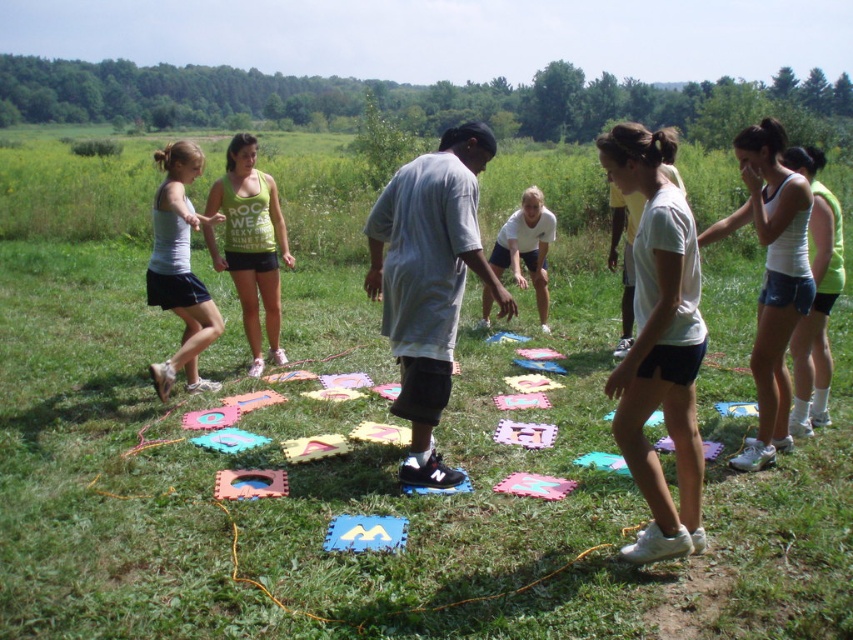
Question: Estimate the real-world distances between objects in this image. Which object is closer to the matte gray tank top at left?

Choices:
 (A) white matte tank top at upper right
 (B) gray cotton shirt at center
 (C) green/yellow tank top at center

Answer: (C)

Question: Can you confirm if matte gray tank top at left is smaller than white matte shirt at center?

Choices:
 (A) no
 (B) yes

Answer: (A)

Question: Does gray cotton shirt at center appear over green/yellow tank top at center?

Choices:
 (A) no
 (B) yes

Answer: (A)

Question: Is gray cotton shirt at center thinner than white matte tank top at upper right?

Choices:
 (A) no
 (B) yes

Answer: (B)

Question: Which object is the farthest from the green/yellow tank top at center?

Choices:
 (A) matte gray tank top at left
 (B) white matte shorts at center
 (C) gray cotton shirt at center
 (D) white matte tank top at upper right

Answer: (D)

Question: Which object is the closest to the white matte tank top at upper right?

Choices:
 (A) green/yellow tank top at center
 (B) white matte shirt at center
 (C) matte gray tank top at left
 (D) gray cotton shirt at center

Answer: (D)